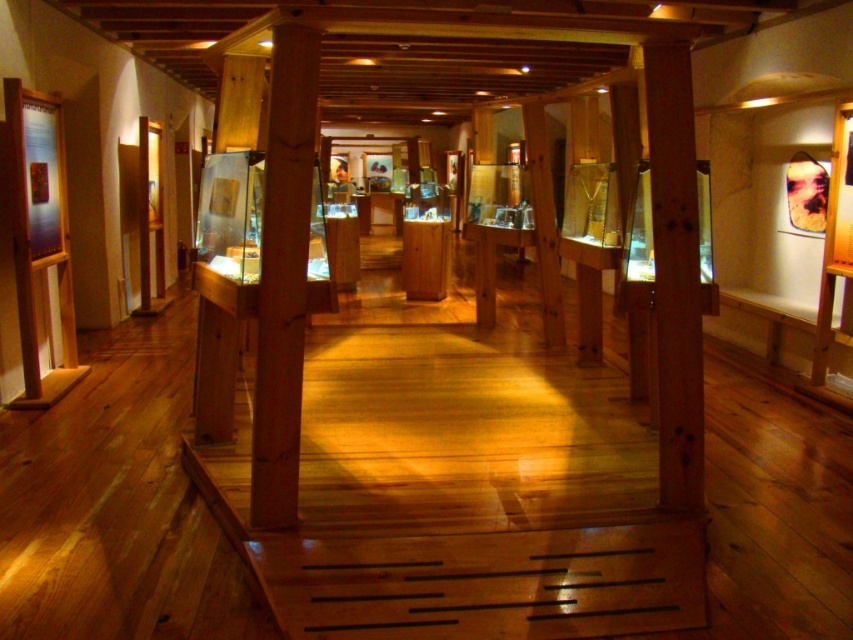
Question: Does natural wood column at center have a larger size compared to wooden post at center?

Choices:
 (A) yes
 (B) no

Answer: (B)

Question: Can you confirm if natural wood column at center is positioned to the right of wooden post at center?

Choices:
 (A) yes
 (B) no

Answer: (B)

Question: Among these points, which one is nearest to the camera?

Choices:
 (A) (688, 500)
 (B) (302, 339)

Answer: (B)

Question: Does natural wood column at center appear under wooden post at center?

Choices:
 (A) no
 (B) yes

Answer: (B)

Question: Which point appears closest to the camera in this image?

Choices:
 (A) (305, 272)
 (B) (659, 492)

Answer: (A)